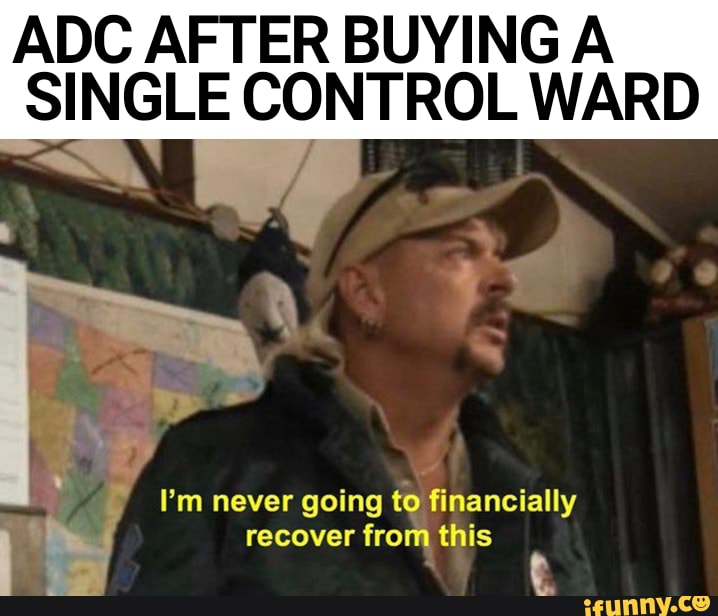
In order to click on map of us in background in this screenshot , I will do `click(123, 435)`.